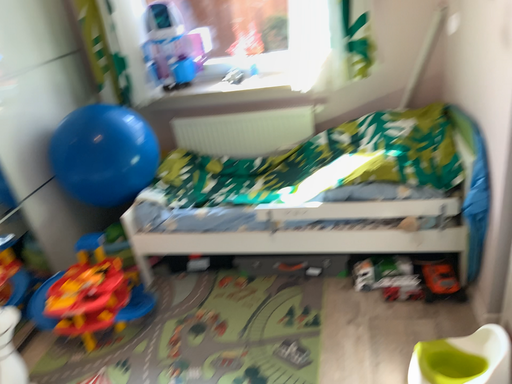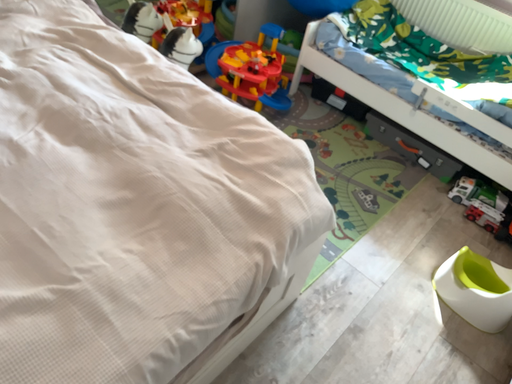
Question: How did the camera likely rotate when shooting the video?

Choices:
 (A) rotated right
 (B) rotated left

Answer: (B)